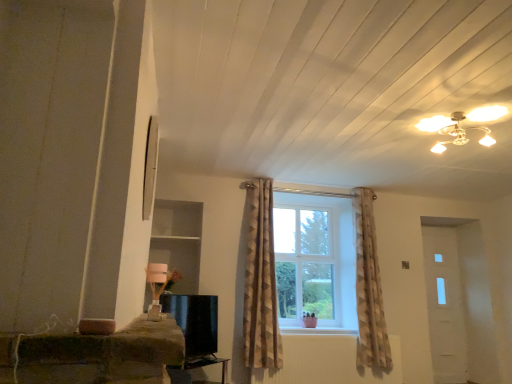
Where is `brown textured curtain at center`? brown textured curtain at center is located at coordinates (260, 281).

Where is `black glossy tv at lower center`? This screenshot has width=512, height=384. black glossy tv at lower center is located at coordinates (196, 328).

Where is `black glossy tv stand at lower center`? This screenshot has height=384, width=512. black glossy tv stand at lower center is located at coordinates (207, 364).

Does black glossy tv at lower center appear on the left side of brown textured curtain at center?

Correct, you'll find black glossy tv at lower center to the left of brown textured curtain at center.

At what (x,y) coordinates should I click in order to perform the action: click on entertainment center below the brown textured curtain at center (from a real-world perspective). Please return your answer as a coordinate pair (x, y). The image size is (512, 384). Looking at the image, I should click on (196, 328).

From the image's perspective, between black glossy tv at lower center and brown textured curtain at center, who is located below?

black glossy tv at lower center, from the image's perspective.

Does brown textured curtain at center have a greater height compared to black glossy tv stand at lower center?

Yes.

Considering the relative positions of brown textured curtain at center and black glossy tv stand at lower center in the image provided, is brown textured curtain at center to the right of black glossy tv stand at lower center from the viewer's perspective?

Yes, brown textured curtain at center is to the right of black glossy tv stand at lower center.

Looking at this image, from a real-world perspective, which object rests below the other?

From a 3D spatial view, black glossy tv stand at lower center is below.

Considering the positions of points (193, 362) and (193, 310), is point (193, 362) farther from camera compared to point (193, 310)?

No, (193, 362) is in front of (193, 310).

Considering the relative sizes of black glossy tv stand at lower center and black glossy tv at lower center in the image provided, is black glossy tv stand at lower center thinner than black glossy tv at lower center?

Incorrect, the width of black glossy tv stand at lower center is not less than that of black glossy tv at lower center.

Does black glossy tv stand at lower center turn towards black glossy tv at lower center?

No, black glossy tv stand at lower center does not turn towards black glossy tv at lower center.

Can you confirm if black glossy tv stand at lower center is positioned to the left of black glossy tv at lower center?

No, black glossy tv stand at lower center is not to the left of black glossy tv at lower center.

Is black glossy tv at lower center next to black glossy tv stand at lower center?

black glossy tv at lower center is not next to black glossy tv stand at lower center, and they're not touching.

Consider the image. Would you say black glossy tv at lower center is to the left or to the right of black glossy tv stand at lower center in the picture?

From the image, it's evident that black glossy tv at lower center is to the left of black glossy tv stand at lower center.

Between point (195, 346) and point (198, 359), which one is positioned behind?

Point (195, 346)

From a real-world perspective, does black glossy tv at lower center sit lower than black glossy tv stand at lower center?

Incorrect, from a real-world perspective, black glossy tv at lower center is higher than black glossy tv stand at lower center.

How many degrees apart are the facing directions of brown textured curtain at center and black glossy tv at lower center?

53.1 degrees separate the facing orientations of brown textured curtain at center and black glossy tv at lower center.

From the image's perspective, relative to black glossy tv at lower center, is brown textured curtain at center above or below?

From the image's perspective, brown textured curtain at center appears above black glossy tv at lower center.

Based on their sizes in the image, would you say brown textured curtain at center is bigger or smaller than black glossy tv at lower center?

brown textured curtain at center is bigger than black glossy tv at lower center.

The height and width of the screenshot is (384, 512). Find the location of `curtain on the right of black glossy tv at lower center`. curtain on the right of black glossy tv at lower center is located at coordinates (260, 281).

Could you tell me if black glossy tv stand at lower center is facing brown textured curtain at center?

No, black glossy tv stand at lower center does not turn towards brown textured curtain at center.

Between black glossy tv stand at lower center and brown textured curtain at center, which one has more height?

brown textured curtain at center.

Is black glossy tv stand at lower center inside or outside of brown textured curtain at center?

black glossy tv stand at lower center cannot be found inside brown textured curtain at center.

How much distance is there between black glossy tv stand at lower center and brown textured curtain at center?

33.83 inches.

You are a GUI agent. You are given a task and a screenshot of the screen. Output one action in this format:
    pyautogui.click(x=<x>, y=<y>)
    Task: Click on the entertainment center that appears on the left of brown textured curtain at center
    
    Given the screenshot: What is the action you would take?
    pyautogui.click(x=196, y=328)

At what (x,y) coordinates should I click in order to perform the action: click on table that appears in front of the brown textured curtain at center. Please return your answer as a coordinate pair (x, y). The width and height of the screenshot is (512, 384). Looking at the image, I should click on (207, 364).

Looking at the image, which one is located closer to brown textured curtain at center, black glossy tv stand at lower center or black glossy tv at lower center?

black glossy tv at lower center is positioned closer to the anchor brown textured curtain at center.

Considering their positions, is brown textured curtain at center positioned closer to black glossy tv stand at lower center than black glossy tv at lower center?

black glossy tv at lower center lies closer to black glossy tv stand at lower center than the other object.

Considering their positions, is brown textured curtain at center positioned further to black glossy tv at lower center than black glossy tv stand at lower center?

brown textured curtain at center lies further to black glossy tv at lower center than the other object.

Looking at this image, from the image, which object appears to be farther from brown textured curtain at center, black glossy tv at lower center or black glossy tv stand at lower center?

black glossy tv stand at lower center is further to brown textured curtain at center.

When comparing their distances from black glossy tv at lower center, does black glossy tv stand at lower center or brown textured curtain at center seem closer?

Based on the image, black glossy tv stand at lower center appears to be nearer to black glossy tv at lower center.

Looking at the image, which one is located further to black glossy tv stand at lower center, black glossy tv at lower center or brown textured curtain at center?

Among the two, brown textured curtain at center is located further to black glossy tv stand at lower center.

What are the coordinates of `entertainment center between brown textured curtain at center and black glossy tv stand at lower center in the vertical direction` in the screenshot? It's located at (196, 328).